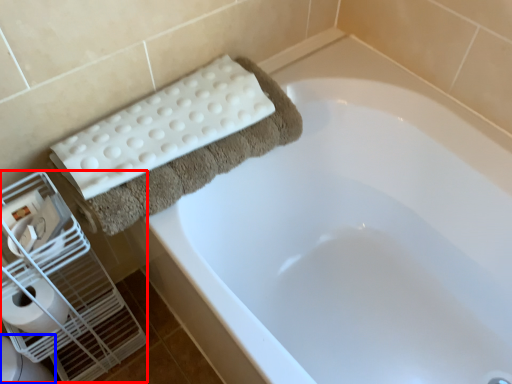
Question: Which of the following is the closest to the observer, bird cage (highlighted by a red box) or toilet bowl (highlighted by a blue box)?

Choices:
 (A) bird cage
 (B) toilet bowl

Answer: (A)